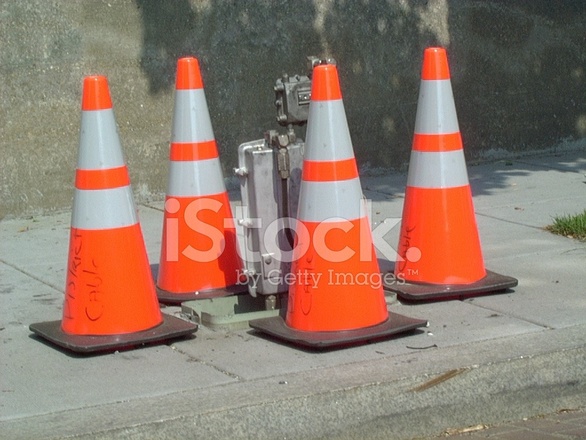
Where is `wall`? The image size is (586, 440). wall is located at coordinates (47, 108).